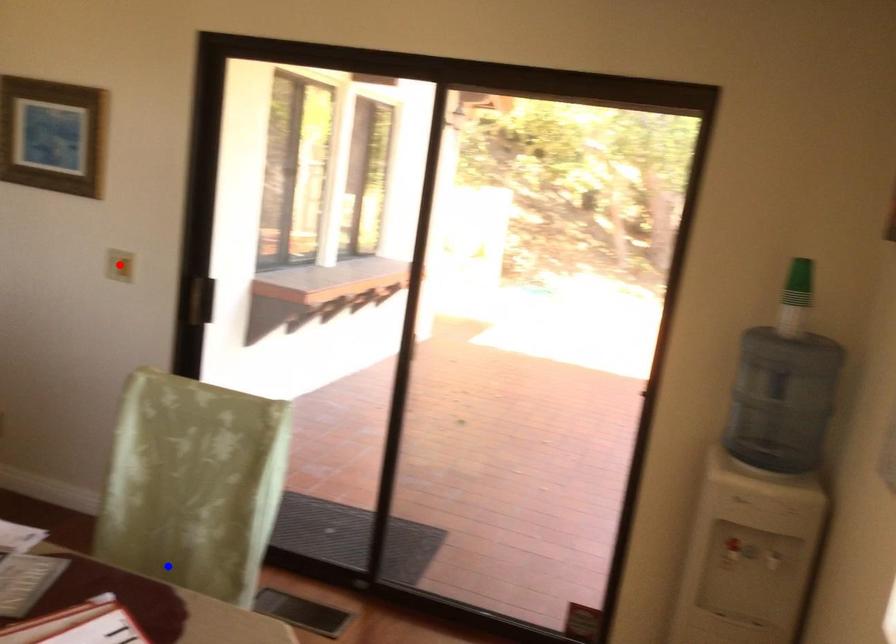
Question: In the image, two points are highlighted. Which point is nearer to the camera? Reply with the corresponding letter.

Choices:
 (A) blue point
 (B) red point

Answer: (A)